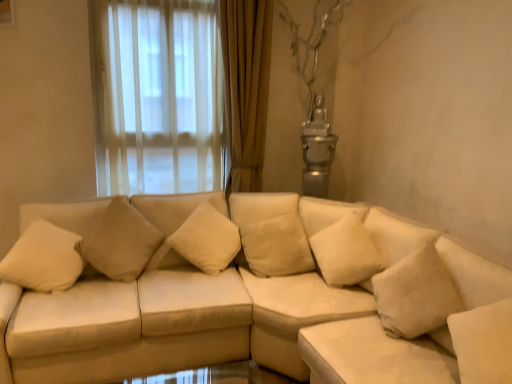
Question: Considering their positions, is beige leather couch at center located in front of or behind beige fabric pillow at center, which is the 2th pillow from left to right?

Choices:
 (A) front
 (B) behind

Answer: (A)

Question: From their relative heights in the image, would you say beige leather couch at center is taller or shorter than beige fabric pillow at center, which is the 2th pillow from left to right?

Choices:
 (A) short
 (B) tall

Answer: (B)

Question: Which object is the farthest from the beige fabric pillow at center, which is the second pillow from right to left?

Choices:
 (A) beige fabric pillow at center, positioned as the first pillow in right-to-left order
 (B) beige leather couch at center

Answer: (A)

Question: Which object is the closest to the beige leather couch at center?

Choices:
 (A) beige fabric pillow at center, which is the second pillow from right to left
 (B) beige fabric pillow at center, which is the 2th pillow from left to right

Answer: (B)